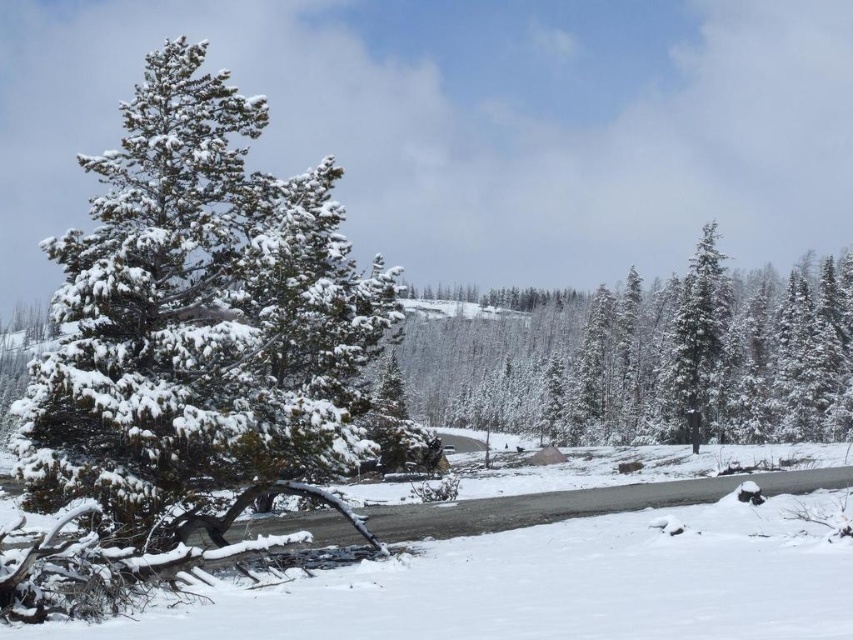
Which of these two, snow-covered pine tree at left or white snow at center, stands taller?

snow-covered pine tree at left is taller.

The image size is (853, 640). What are the coordinates of `snow-covered pine tree at left` in the screenshot? It's located at (206, 326).

This screenshot has height=640, width=853. In order to click on snow-covered pine tree at left in this screenshot , I will do `click(206, 326)`.

Measure the distance between white snow at center and snow-covered evergreen at right.

white snow at center and snow-covered evergreen at right are 114.35 feet apart from each other.

Which of these two, white snow at center or snow-covered evergreen at right, stands shorter?

white snow at center

Is point (641, 488) closer to camera compared to point (704, 336)?

Yes, point (641, 488) is in front of point (704, 336).

The width and height of the screenshot is (853, 640). Identify the location of white snow at center. [x=555, y=582].

Is snow-covered pine tree at left bigger than green textured pine tree at center?

Yes.

Which is behind, point (224, 81) or point (581, 406)?

Point (581, 406)

Locate an element on the screen. The image size is (853, 640). snow-covered pine tree at left is located at coordinates (206, 326).